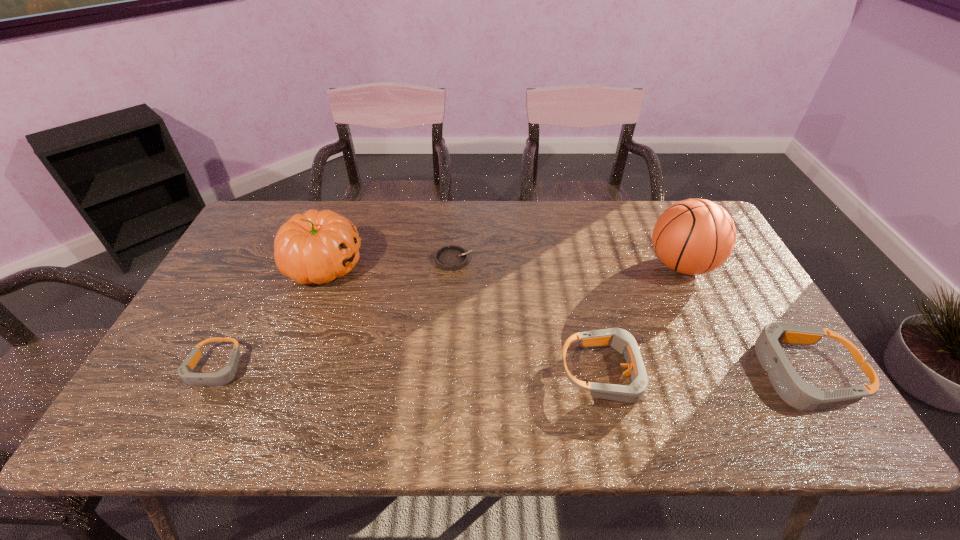
Find the location of a particular element. free space between the basketball and the second tallest object is located at coordinates (502, 265).

At what (x,y) coordinates should I click in order to perform the action: click on free space between the shortest goggles and the second tallest object. Please return your answer as a coordinate pair (x, y). The width and height of the screenshot is (960, 540). Looking at the image, I should click on (270, 317).

This screenshot has width=960, height=540. I want to click on unoccupied area between the rightmost goggles and the leftmost goggles, so click(509, 372).

Identify the location of vacant space in between the fifth tallest object and the rightmost goggles. (509, 372).

The height and width of the screenshot is (540, 960). I want to click on vacant region between the fifth shortest object and the shortest object, so click(389, 262).

This screenshot has width=960, height=540. I want to click on unoccupied area between the second tallest object and the third shortest object, so click(465, 319).

Find the location of a particular element. The height and width of the screenshot is (540, 960). vacant area between the third object from left to right and the leftmost goggles is located at coordinates (335, 314).

Where is `unoccupied position between the tallest object and the second shortest goggles`? Image resolution: width=960 pixels, height=540 pixels. unoccupied position between the tallest object and the second shortest goggles is located at coordinates (643, 319).

This screenshot has height=540, width=960. Find the location of `object that is the fourth closest to the fifth tallest object`. object that is the fourth closest to the fifth tallest object is located at coordinates (695, 236).

Identify which object is the fifth nearest to the second tallest object. Please provide its 2D coordinates. Your answer should be formatted as a tuple, i.e. [(x, y)], where the tuple contains the x and y coordinates of a point satisfying the conditions above.

[(795, 391)]